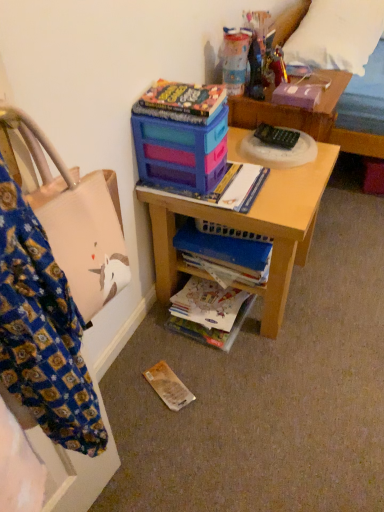
Identify the location of free point above matte plastic magazine at center (from a real-world perspective). This screenshot has width=384, height=512. (206, 184).